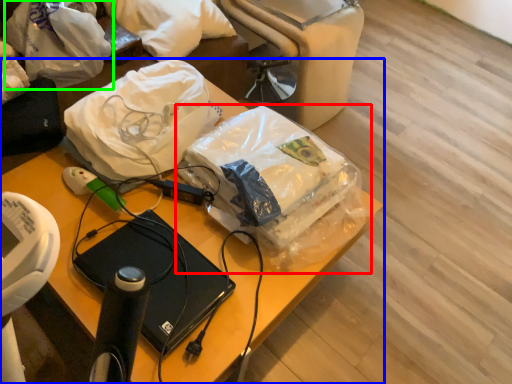
Question: Which is nearer to the plastic bag (highlighted by a red box)? furniture (highlighted by a blue box) or plastic bag (highlighted by a green box).

Choices:
 (A) furniture
 (B) plastic bag

Answer: (A)